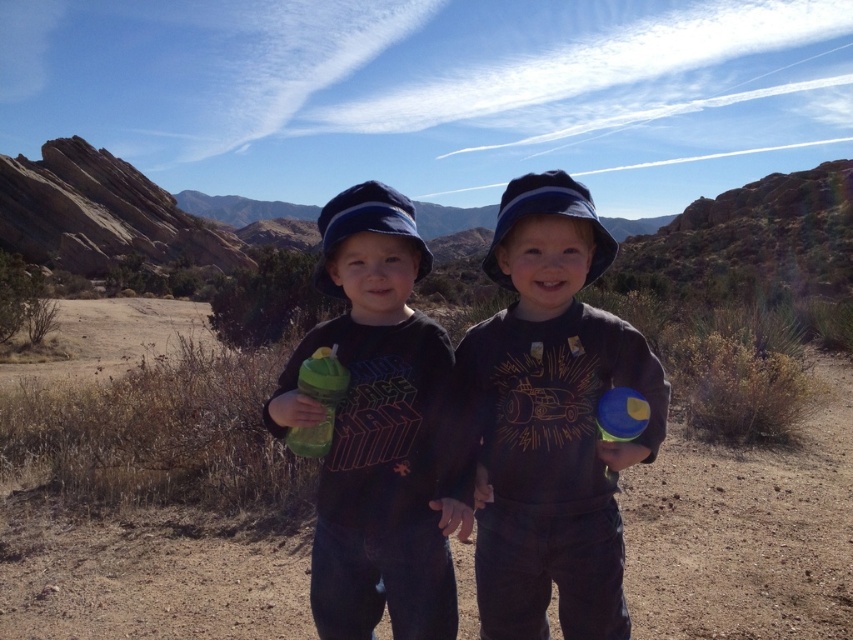
Question: Which point is farther to the camera?

Choices:
 (A) dark gray cotton shirt at center
 (B) matte black shirt at center

Answer: (A)

Question: Does dark gray cotton shirt at center appear on the right side of matte black shirt at center?

Choices:
 (A) yes
 (B) no

Answer: (A)

Question: Can you confirm if dark gray cotton shirt at center is positioned below matte black shirt at center?

Choices:
 (A) no
 (B) yes

Answer: (A)

Question: Can you confirm if dark gray cotton shirt at center is wider than matte black shirt at center?

Choices:
 (A) no
 (B) yes

Answer: (A)